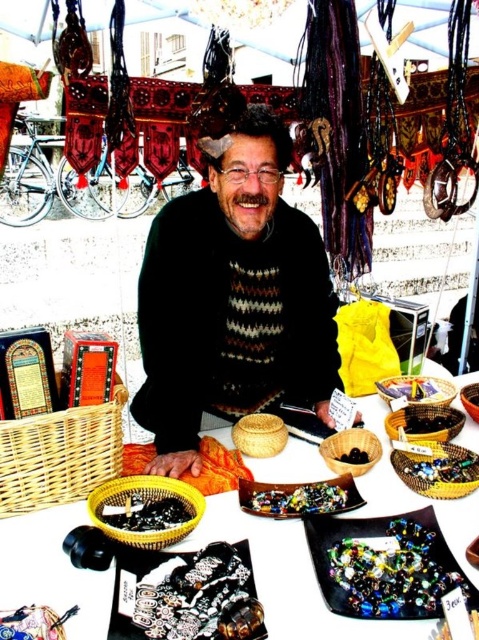
Question: Does black glossy beads at lower left come in front of black woven basket at center?

Choices:
 (A) no
 (B) yes

Answer: (B)

Question: Does silver metallic bracelet at center appear on the left side of black glossy beads at lower left?

Choices:
 (A) yes
 (B) no

Answer: (B)

Question: Which point is farther to the camera?

Choices:
 (A) (471, 477)
 (B) (54, 573)
 (C) (293, 513)

Answer: (A)

Question: Does knitted sweater at center appear under translucent glass beads at center?

Choices:
 (A) no
 (B) yes

Answer: (A)

Question: Which point is closer to the camera?

Choices:
 (A) multicolored glass beads at center
 (B) wooden table at center

Answer: (B)

Question: Which is farther from the translucent glass beads at lower center?

Choices:
 (A) black glossy beads at lower left
 (B) black woven basket at center

Answer: (A)